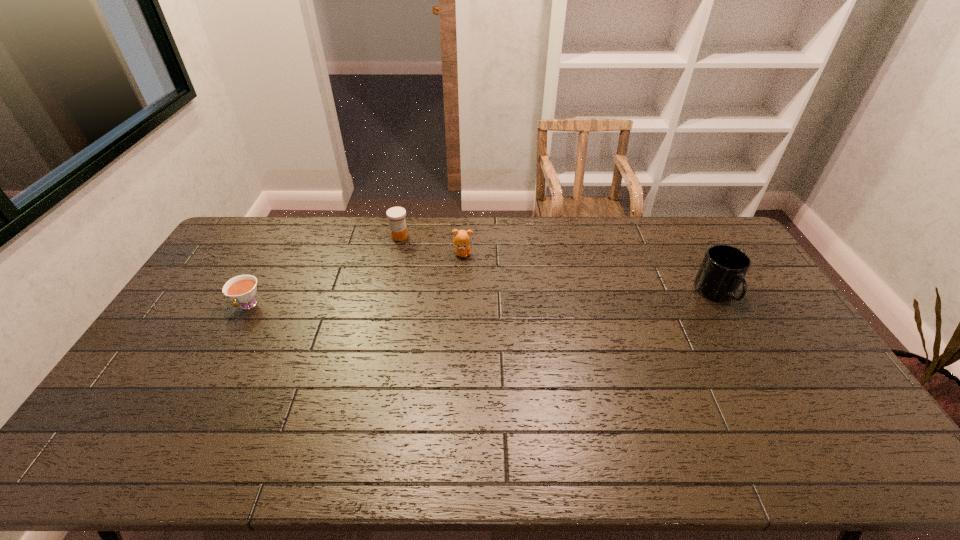
Where is `the leftmost object`? The width and height of the screenshot is (960, 540). the leftmost object is located at coordinates (242, 289).

I want to click on teacup, so click(x=242, y=289).

I want to click on the tallest object, so (724, 267).

The width and height of the screenshot is (960, 540). Find the location of `the rightmost object`. the rightmost object is located at coordinates (724, 267).

Locate an element on the screen. This screenshot has width=960, height=540. medicine is located at coordinates (396, 215).

In order to click on the farthest object in this screenshot , I will do `click(396, 215)`.

Identify the location of the second object from right to left. The height and width of the screenshot is (540, 960). (461, 240).

Find the location of `the second farthest object`. the second farthest object is located at coordinates (461, 240).

This screenshot has width=960, height=540. Identify the location of vacant space located on the side of the shortest object with the handle. (205, 383).

You are a GUI agent. You are given a task and a screenshot of the screen. Output one action in this format:
    pyautogui.click(x=<x>, y=<y>)
    Task: Click on the vacant space located with the handle on the side of the mug
    This screenshot has height=540, width=960.
    Given the screenshot: What is the action you would take?
    pyautogui.click(x=772, y=390)